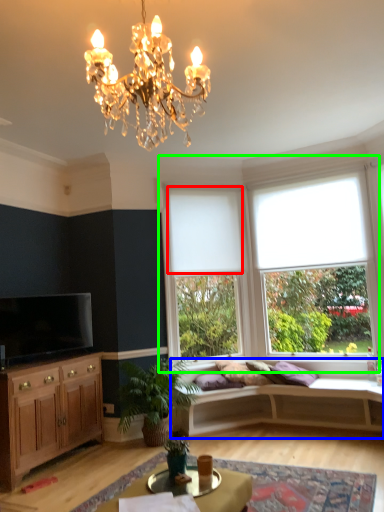
Question: Considering the real-world distances, which object is farthest from blind (highlighted by a red box)? studio couch (highlighted by a blue box) or window (highlighted by a green box)?

Choices:
 (A) studio couch
 (B) window

Answer: (A)